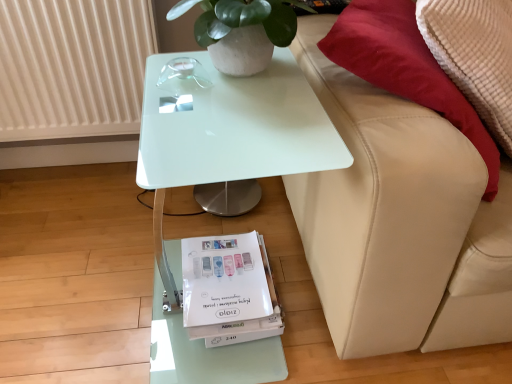
Locate an element on the screen. This screenshot has height=384, width=512. vacant region below white matte pot at upper center (from a real-world perspective) is located at coordinates (243, 77).